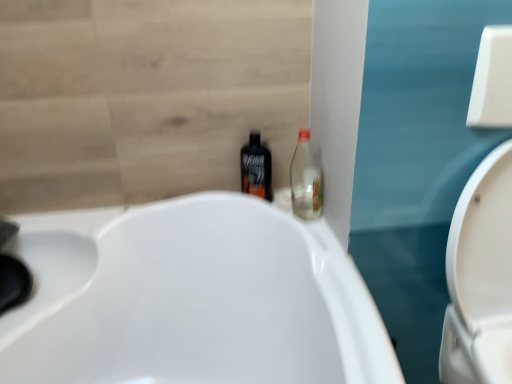
Question: Does white glossy toilet at right have a lesser height compared to black plastic bottle at center, the 1th bottle positioned from the left?

Choices:
 (A) no
 (B) yes

Answer: (A)

Question: Is white glossy toilet at right next to black plastic bottle at center, the second bottle from the right?

Choices:
 (A) no
 (B) yes

Answer: (A)

Question: From a real-world perspective, is white glossy toilet at right positioned under black plastic bottle at center, the 1th bottle positioned from the left, based on gravity?

Choices:
 (A) yes
 (B) no

Answer: (A)

Question: Can black plastic bottle at center, the second bottle from the right, be found inside white glossy toilet at right?

Choices:
 (A) no
 (B) yes

Answer: (A)

Question: Would you say white glossy toilet at right is outside black plastic bottle at center, the 1th bottle positioned from the left?

Choices:
 (A) yes
 (B) no

Answer: (A)

Question: Does white glossy toilet at right have a smaller size compared to black plastic bottle at center, the 1th bottle positioned from the left?

Choices:
 (A) yes
 (B) no

Answer: (B)

Question: Can you confirm if transparent glass bottle at center-right, the 1th bottle from the right, is bigger than black plastic bottle at center, the second bottle from the right?

Choices:
 (A) yes
 (B) no

Answer: (A)

Question: Can you confirm if transparent glass bottle at center-right, arranged as the 2th bottle when viewed from the left, is wider than black plastic bottle at center, the second bottle from the right?

Choices:
 (A) no
 (B) yes

Answer: (A)

Question: Is transparent glass bottle at center-right, the 1th bottle from the right, oriented towards black plastic bottle at center, the second bottle from the right?

Choices:
 (A) no
 (B) yes

Answer: (A)

Question: Does transparent glass bottle at center-right, arranged as the 2th bottle when viewed from the left, contain black plastic bottle at center, the 1th bottle positioned from the left?

Choices:
 (A) no
 (B) yes

Answer: (A)

Question: Does transparent glass bottle at center-right, arranged as the 2th bottle when viewed from the left, have a lesser width compared to black plastic bottle at center, the 1th bottle positioned from the left?

Choices:
 (A) yes
 (B) no

Answer: (A)

Question: From a real-world perspective, is transparent glass bottle at center-right, the 1th bottle from the right, on top of black plastic bottle at center, the 1th bottle positioned from the left?

Choices:
 (A) no
 (B) yes

Answer: (B)

Question: Is white glossy toilet at right surrounded by black plastic bottle at center, the second bottle from the right?

Choices:
 (A) no
 (B) yes

Answer: (A)